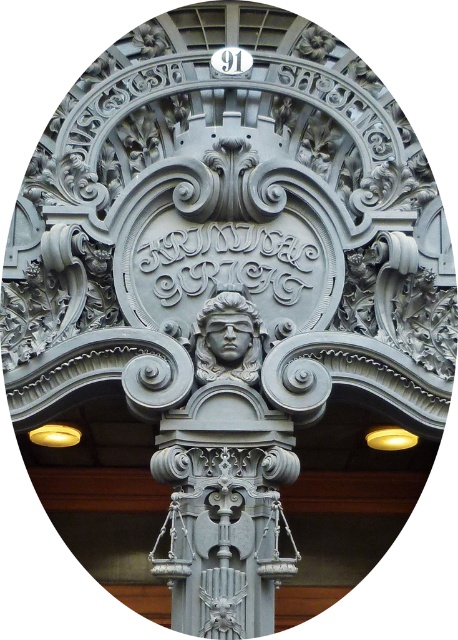
Is matte gray statue at center in front of matte gray stone face at center?

No, it is behind matte gray stone face at center.

Identify the location of matte gray statue at center. The height and width of the screenshot is (640, 458). (228, 339).

Is point (252, 355) positioned behind point (223, 328)?

Yes, it is.

Where is `matte gray statue at center`? Image resolution: width=458 pixels, height=640 pixels. matte gray statue at center is located at coordinates (228, 339).